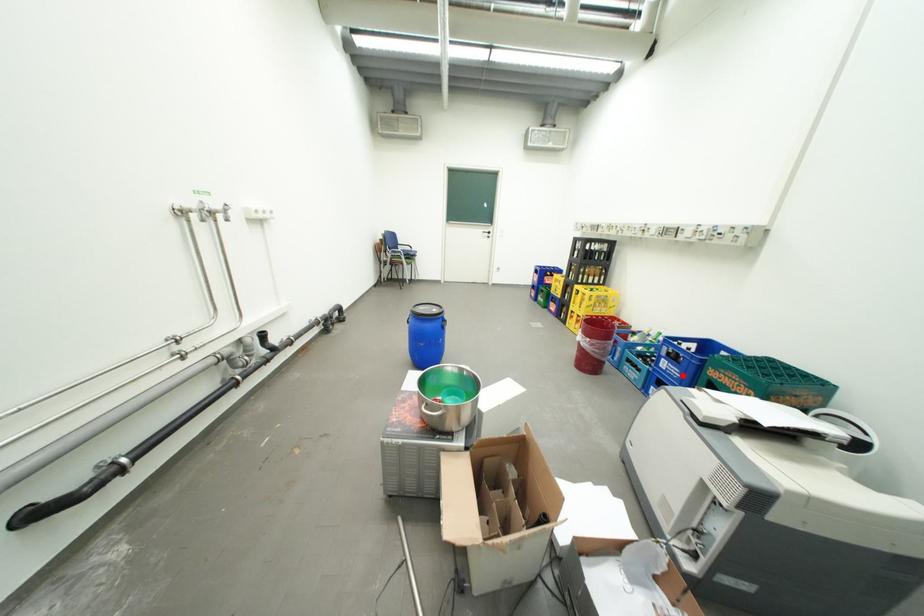
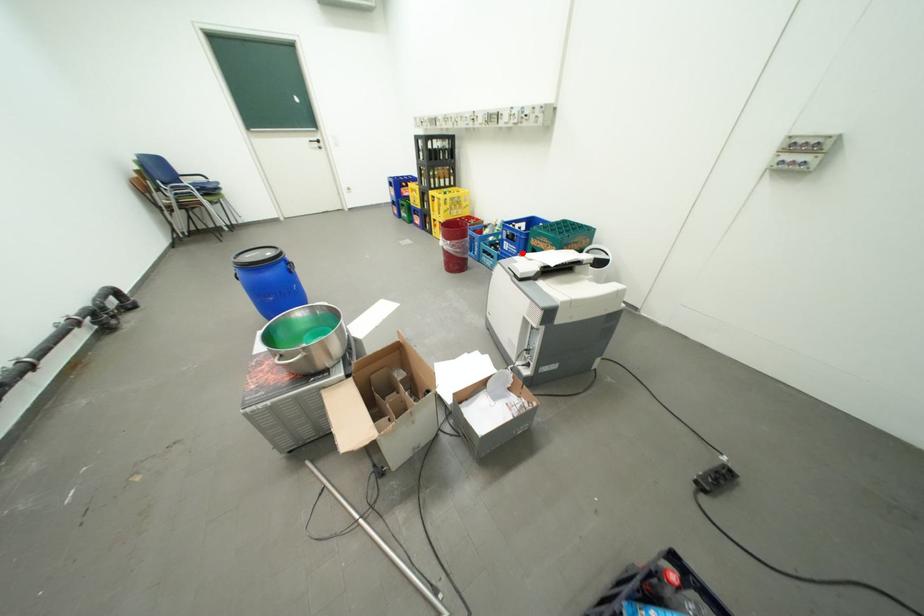
I am providing you with two images of the same scene from different viewpoints. A red point is marked on the first image and another point is marked on the second image. Does the point marked in image1 correspond to the same location as the one in image2?

Yes